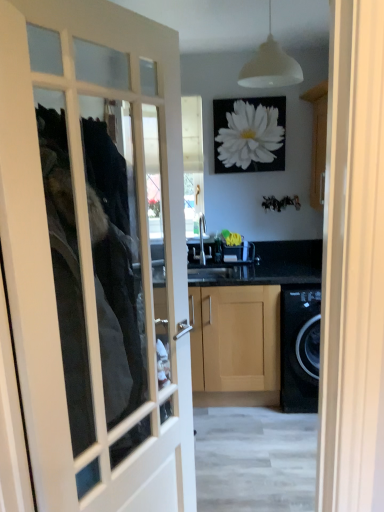
Question: In terms of height, does white matte flower at upper center look taller or shorter compared to white glass door at center?

Choices:
 (A) tall
 (B) short

Answer: (B)

Question: In terms of width, does white matte flower at upper center look wider or thinner when compared to white glass door at center?

Choices:
 (A) wide
 (B) thin

Answer: (B)

Question: Estimate the real-world distances between objects in this image. Which object is farther from the light wood/finished cabinet at center?

Choices:
 (A) white glass door at center
 (B) white matte flower at upper center
 (C) white matte light fixture at upper center

Answer: (C)

Question: Which object is the farthest from the light wood/finished cabinet at center?

Choices:
 (A) white glass door at center
 (B) white matte flower at upper center
 (C) white matte light fixture at upper center

Answer: (C)